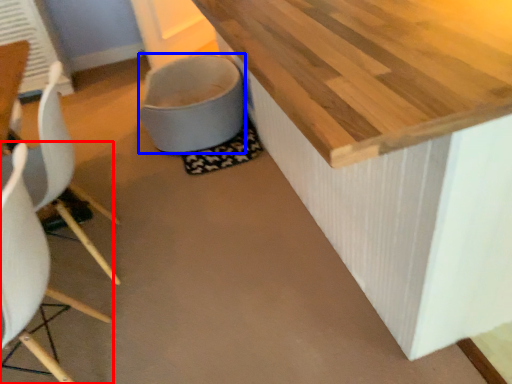
Question: Which object appears farthest to the camera in this image, chair (highlighted by a red box) or toilet bowl (highlighted by a blue box)?

Choices:
 (A) chair
 (B) toilet bowl

Answer: (B)